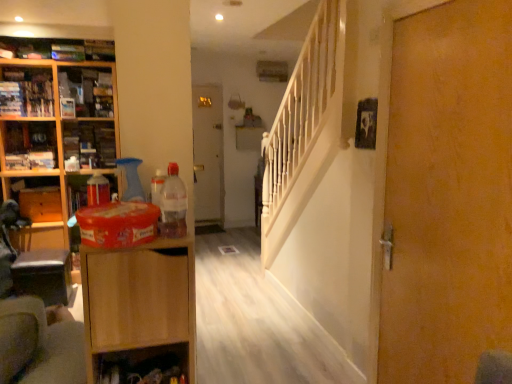
Question: Is wooden cabinet at left, acting as the 2th cabinet starting from the bottom, with matte plastic container at left, which appears as the 3th cabinet when viewed from the top?

Choices:
 (A) yes
 (B) no

Answer: (B)

Question: From the image's perspective, is wooden cabinet at left, acting as the 2th cabinet starting from the top, over matte plastic container at left, which appears as the 1th cabinet when viewed from the front?

Choices:
 (A) no
 (B) yes

Answer: (B)

Question: Is wooden cabinet at left, the 2th cabinet viewed from the right, at the left side of matte plastic container at left, which appears as the 3th cabinet when viewed from the top?

Choices:
 (A) yes
 (B) no

Answer: (A)

Question: From the image's perspective, is wooden cabinet at left, arranged as the first cabinet when viewed from the back, beneath matte plastic container at left, positioned as the 3th cabinet in left-to-right order?

Choices:
 (A) no
 (B) yes

Answer: (A)

Question: Could you tell me if wooden cabinet at left, acting as the 2th cabinet starting from the bottom, is facing matte plastic container at left, arranged as the 3th cabinet when viewed from the back?

Choices:
 (A) yes
 (B) no

Answer: (A)

Question: Considering the positions of point (165, 211) and point (185, 372), is point (165, 211) closer or farther from the camera than point (185, 372)?

Choices:
 (A) closer
 (B) farther

Answer: (A)

Question: Based on their sizes in the image, would you say translucent plastic bottle at center is bigger or smaller than wooden shelf at lower center?

Choices:
 (A) small
 (B) big

Answer: (A)

Question: Considering the relative positions of translucent plastic bottle at center and wooden shelf at lower center in the image provided, is translucent plastic bottle at center to the left or to the right of wooden shelf at lower center?

Choices:
 (A) left
 (B) right

Answer: (B)

Question: Is translucent plastic bottle at center situated inside wooden shelf at lower center or outside?

Choices:
 (A) outside
 (B) inside

Answer: (A)

Question: From the image's perspective, relative to light brown wood cabinet at left, the 2th cabinetry in the back-to-front sequence, is wooden door at right, the 2th door from the left, above or below?

Choices:
 (A) above
 (B) below

Answer: (A)

Question: From a real-world perspective, is wooden door at right, the first door positioned from the right, above or below light brown wood cabinet at left, the 2th cabinetry in the back-to-front sequence?

Choices:
 (A) above
 (B) below

Answer: (A)

Question: Does point pos(485,322) appear closer or farther from the camera than point pos(124,347)?

Choices:
 (A) farther
 (B) closer

Answer: (A)

Question: Considering their positions, is wooden door at right, the first door in the front-to-back sequence, located in front of or behind light brown wood cabinet at left, the first cabinetry from the front?

Choices:
 (A) front
 (B) behind

Answer: (B)

Question: Is wooden drawer at left inside the boundaries of light brown wood cabinet at left, the 1th cabinetry from the right, or outside?

Choices:
 (A) inside
 (B) outside

Answer: (B)

Question: In terms of size, does wooden drawer at left appear bigger or smaller than light brown wood cabinet at left, the 1th cabinetry from the right?

Choices:
 (A) small
 (B) big

Answer: (A)